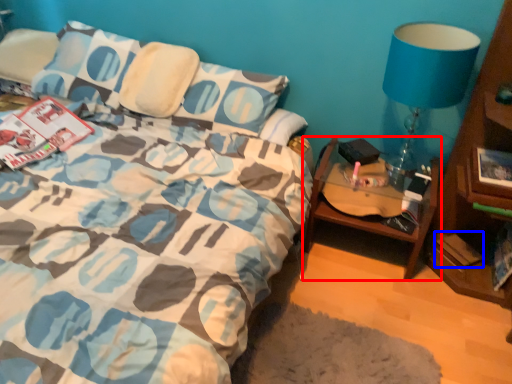
Question: Among these objects, which one is nearest to the camera, table (highlighted by a red box) or paperback book (highlighted by a blue box)?

Choices:
 (A) table
 (B) paperback book

Answer: (A)